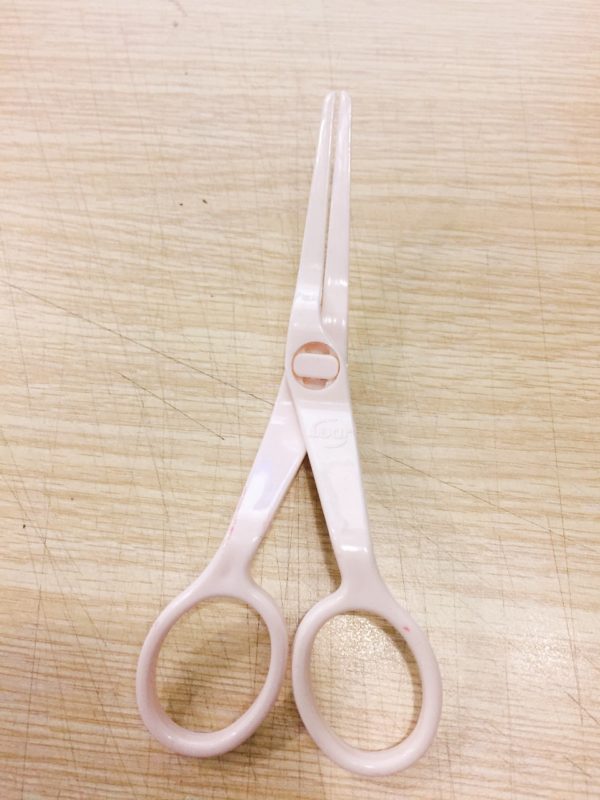
I want to click on hook, so click(239, 730).